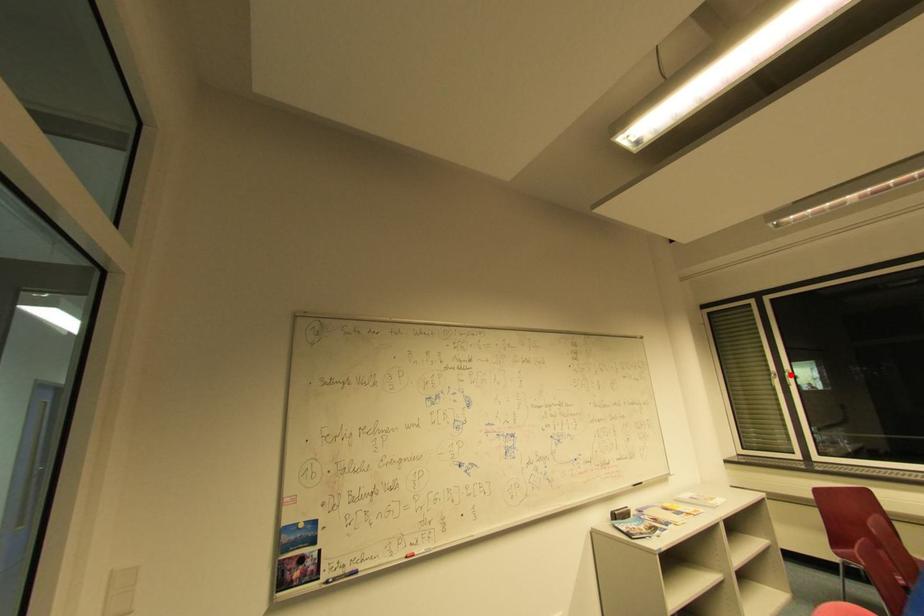
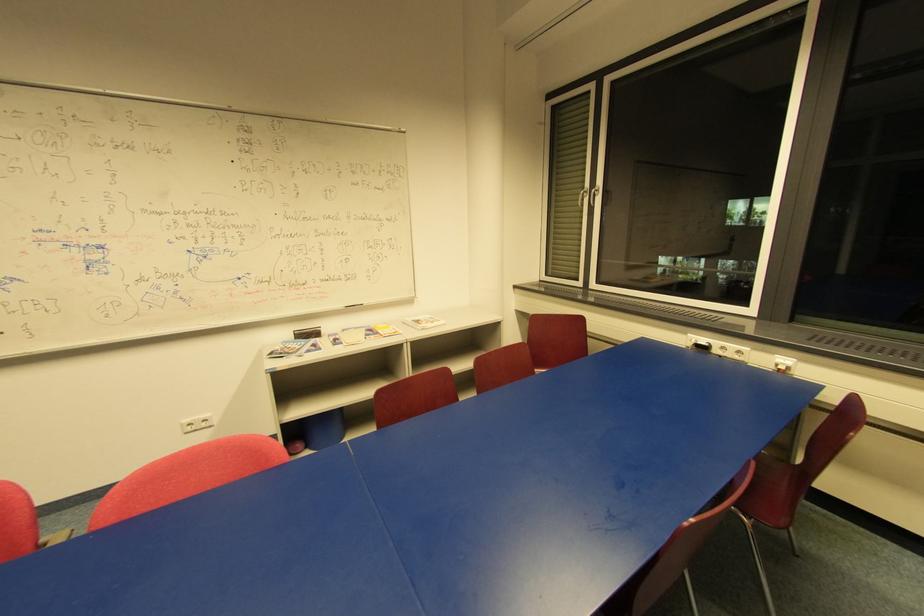
Question: I am providing you with two images of the same scene from different viewpoints. Image1 has a red point marked. In image2, the corresponding 3D location appears at what relative position? Reply with the corresponding letter.

Choices:
 (A) Closer
 (B) Farther

Answer: (B)